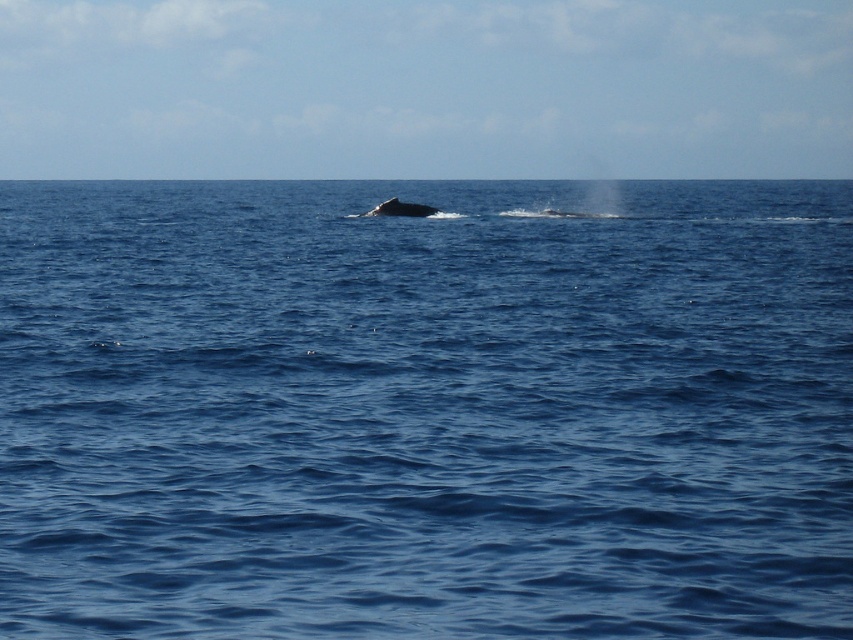
You are a marine biologist observing the ocean scene. You notice the blue water at center and the gray matte whale at center. Which object occupies a larger horizontal space in the image?

The blue water at center has a greater width than the gray matte whale at center, so the blue water at center occupies a larger horizontal space in the image.

You are a marine biologist observing the ocean scene. You notice the blue water at center and the gray matte whale at center. Based on the distance between them, can you determine if the whale is close enough to the surface to be fully visible from above?

The distance between the blue water at center and the gray matte whale at center is 95.58 feet. Since the whale is partially submerged and the water is clear, if the whale is within 100 feet, it can be seen from above. Therefore, the gray matte whale at center is close enough to the surface to be fully visible from above.